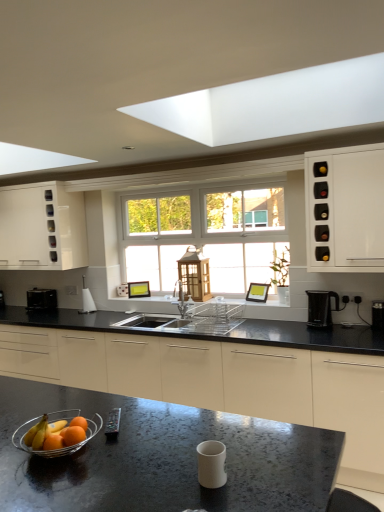
Question: From a real-world perspective, is black plastic coffee maker at right, which is counted as the fifth appliance, starting from the left, on top of metallic remote control at center, the 3th appliance positioned from the right?

Choices:
 (A) yes
 (B) no

Answer: (A)

Question: Is black plastic coffee maker at right, which is counted as the fifth appliance, starting from the left, thinner than metallic remote control at center, the 4th appliance viewed from the back?

Choices:
 (A) yes
 (B) no

Answer: (B)

Question: Is black plastic coffee maker at right, which is counted as the fifth appliance, starting from the left, oriented away from metallic remote control at center, which ranks as the 3th appliance in left-to-right order?

Choices:
 (A) yes
 (B) no

Answer: (B)

Question: Does black plastic coffee maker at right, which is the 1th appliance in right-to-left order, turn towards metallic remote control at center, the 3th appliance positioned from the right?

Choices:
 (A) no
 (B) yes

Answer: (A)

Question: Is black plastic coffee maker at right, which is counted as the fifth appliance, starting from the left, next to metallic remote control at center, which is the second appliance from front to back, and touching it?

Choices:
 (A) no
 (B) yes

Answer: (A)

Question: Is matte black toaster at left, acting as the 1th appliance starting from the back, inside the boundaries of black plastic coffee maker at right, which is the 1th appliance in right-to-left order, or outside?

Choices:
 (A) outside
 (B) inside

Answer: (A)

Question: From the image's perspective, relative to black plastic coffee maker at right, which is the 1th appliance in right-to-left order, is matte black toaster at left, acting as the 1th appliance starting from the back, above or below?

Choices:
 (A) above
 (B) below

Answer: (B)

Question: From a real-world perspective, is matte black toaster at left, which is counted as the 1th appliance, starting from the left, positioned above or below black plastic coffee maker at right, which is the 1th appliance in right-to-left order?

Choices:
 (A) below
 (B) above

Answer: (B)

Question: In terms of height, does matte black toaster at left, marked as the fifth appliance in a right-to-left arrangement, look taller or shorter compared to black plastic coffee maker at right, which is the 1th appliance in right-to-left order?

Choices:
 (A) short
 (B) tall

Answer: (B)

Question: Would you say black plastic coffee maker at right, the third appliance from the front, is inside or outside metallic silver faucet at center?

Choices:
 (A) outside
 (B) inside

Answer: (A)

Question: Considering their positions, is black plastic coffee maker at right, which is counted as the fifth appliance, starting from the left, located in front of or behind metallic silver faucet at center?

Choices:
 (A) behind
 (B) front

Answer: (B)

Question: Based on their positions, is black plastic coffee maker at right, which is counted as the fifth appliance, starting from the left, located to the left or right of metallic silver faucet at center?

Choices:
 (A) left
 (B) right

Answer: (B)

Question: Considering the positions of black plastic coffee maker at right, which appears as the 3th appliance when viewed from the back, and metallic silver faucet at center in the image, is black plastic coffee maker at right, which appears as the 3th appliance when viewed from the back, taller or shorter than metallic silver faucet at center?

Choices:
 (A) short
 (B) tall

Answer: (A)

Question: From a real-world perspective, relative to white glossy trash can at left, which is counted as the 2th appliance, starting from the back, is white matte cup at center, the fourth appliance positioned from the left, vertically above or below?

Choices:
 (A) below
 (B) above

Answer: (A)

Question: Considering the positions of white matte cup at center, the second appliance positioned from the right, and white glossy trash can at left, which is counted as the 2th appliance, starting from the back, in the image, is white matte cup at center, the second appliance positioned from the right, bigger or smaller than white glossy trash can at left, which is counted as the 2th appliance, starting from the back,?

Choices:
 (A) big
 (B) small

Answer: (B)